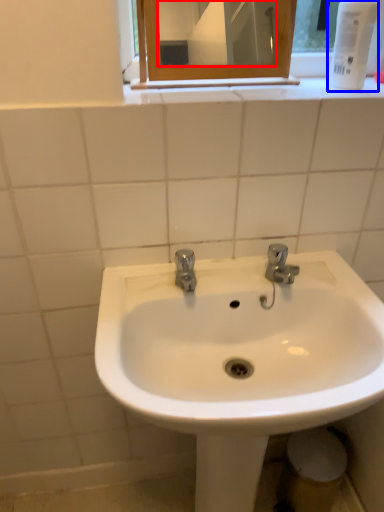
Question: Which object is closer to the camera taking this photo, mirror (highlighted by a red box) or mouthwash (highlighted by a blue box)?

Choices:
 (A) mirror
 (B) mouthwash

Answer: (B)